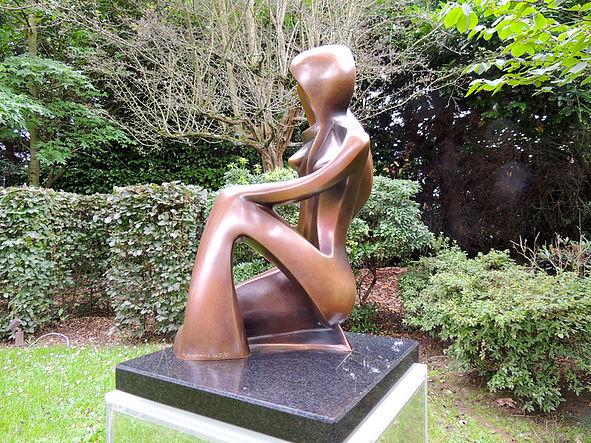
Where is `granite base`? Image resolution: width=591 pixels, height=443 pixels. granite base is located at coordinates (366, 385).